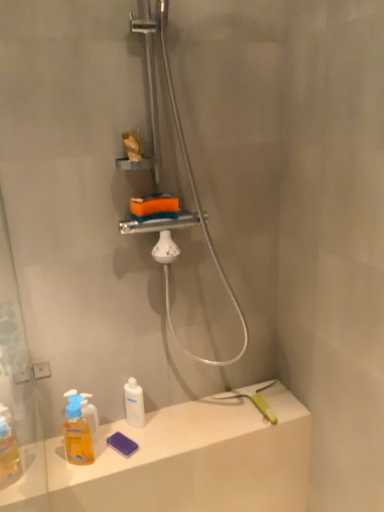
At what (x,y) coordinates should I click in order to perform the action: click on free spot to the left of translucent plastic mouthwash at lower left, positioned as the 1th mouthwash in left-to-right order. Please return your answer as a coordinate pair (x, y). The image size is (384, 512). Looking at the image, I should click on (56, 459).